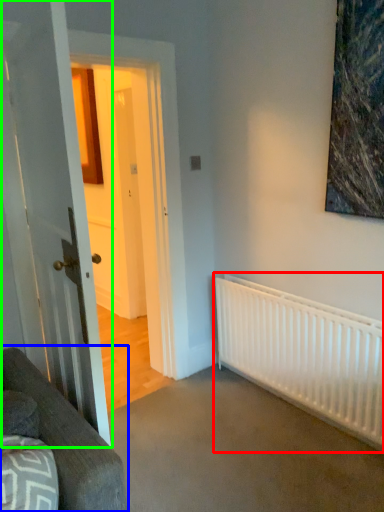
Question: Which object is the farthest from radiator (highlighted by a red box)? Choose among these: studio couch (highlighted by a blue box) or door (highlighted by a green box).

Choices:
 (A) studio couch
 (B) door

Answer: (A)